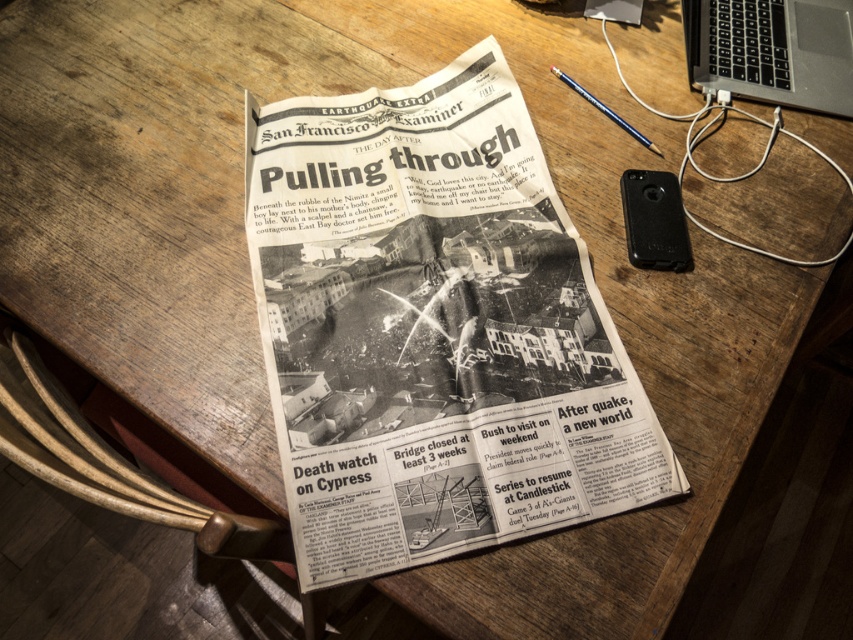
Is point (466, 221) positioned after point (822, 1)?

No.

Does black newspaper at center have a smaller size compared to black plastic laptop at upper right?

Incorrect, black newspaper at center is not smaller in size than black plastic laptop at upper right.

Which is in front, point (485, 209) or point (828, 77)?

Point (485, 209) is in front.

The height and width of the screenshot is (640, 853). I want to click on black newspaper at center, so 433,328.